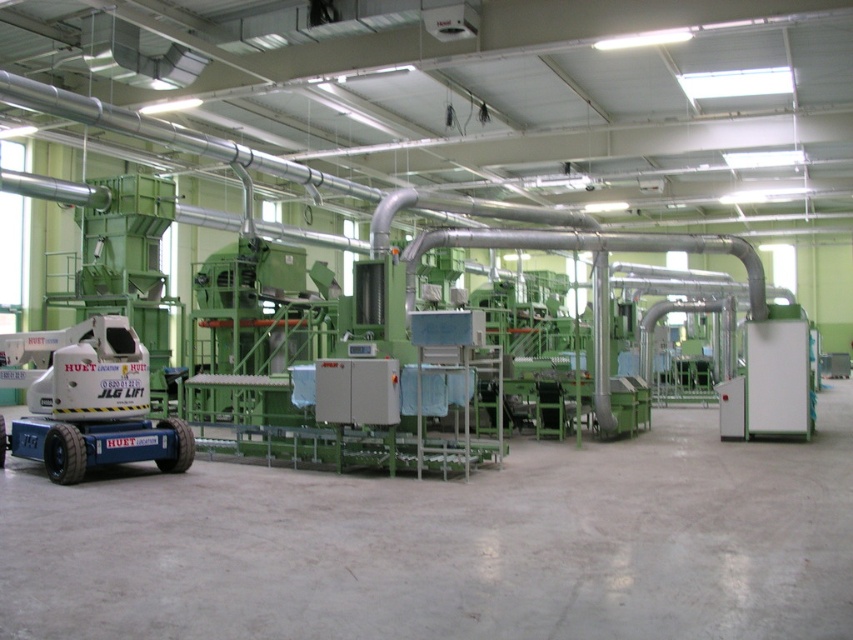
You are an engineer in the facility and need to access the metallic silver pipe at center for maintenance. There is a white plastic lift at left nearby. Can you use the lift to reach the pipe? Explain your reasoning based on their positions.

The white plastic lift at left is positioned on the left side of the metallic silver pipe at center, so the lift is near the pipe. Since the lift is on the left side of the pipe, it can be maneuvered to access the pipe for maintenance.

You are an inspector in the factory and need to access the metallic silver pipe at center for maintenance. There is a white plastic lift at left nearby. Can you use the lift to reach the pipe?

The white plastic lift at left is in front of the metallic silver pipe at center, so it is positioned between you and the pipe. Therefore, you can use the lift to reach the metallic silver pipe at center by moving around it or using its platform to access the pipe.

From the picture: You are navigating through the industrial facility and need to reach a maintenance point located at point (506, 209). You are currently at point (38, 380). Which direction should you move to get closer to your destination?

To reach the maintenance point at point (506, 209) from your current location at point (38, 380), you should move towards the upper left direction since point (38, 380) is in front of point (506, 209).